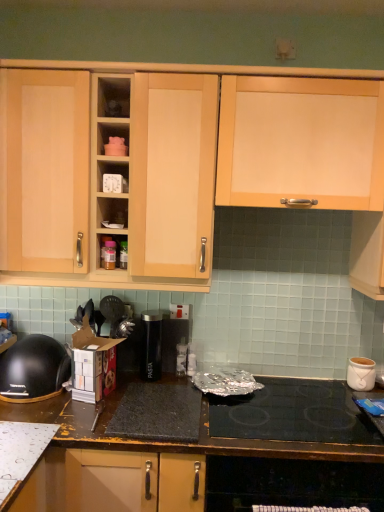
Question: Are black plastic bowl at lower left and white ceramic pot at right located far from each other?

Choices:
 (A) yes
 (B) no

Answer: (A)

Question: From the image's perspective, is black plastic bowl at lower left located above white ceramic pot at right?

Choices:
 (A) yes
 (B) no

Answer: (A)

Question: Does black plastic bowl at lower left have a greater width compared to white ceramic pot at right?

Choices:
 (A) no
 (B) yes

Answer: (B)

Question: From the image's perspective, does black plastic bowl at lower left appear lower than white ceramic pot at right?

Choices:
 (A) yes
 (B) no

Answer: (B)

Question: Is black plastic bowl at lower left looking in the opposite direction of white ceramic pot at right?

Choices:
 (A) yes
 (B) no

Answer: (B)

Question: Is the position of black plastic bowl at lower left less distant than that of white ceramic pot at right?

Choices:
 (A) yes
 (B) no

Answer: (A)

Question: Is matte plastic shelf at center, the first shelf viewed from the top, with light wood cabinet at upper right, the 1th cabinetry in the right-to-left sequence?

Choices:
 (A) no
 (B) yes

Answer: (A)

Question: Considering the relative sizes of matte plastic shelf at center, which is counted as the 2th shelf, starting from the bottom, and light wood cabinet at upper right, the 1th cabinetry in the right-to-left sequence, in the image provided, is matte plastic shelf at center, which is counted as the 2th shelf, starting from the bottom, thinner than light wood cabinet at upper right, the 1th cabinetry in the right-to-left sequence,?

Choices:
 (A) yes
 (B) no

Answer: (A)

Question: From the image's perspective, does matte plastic shelf at center, which is counted as the 2th shelf, starting from the bottom, appear lower than light wood cabinet at upper right, the 1th cabinetry in the right-to-left sequence?

Choices:
 (A) no
 (B) yes

Answer: (A)

Question: Is matte plastic shelf at center, which is counted as the 2th shelf, starting from the bottom, shorter than light wood cabinet at upper right, which ranks as the 2th cabinetry in left-to-right order?

Choices:
 (A) no
 (B) yes

Answer: (B)

Question: Is light wood cabinet at upper right, the 1th cabinetry in the right-to-left sequence, at the back of matte plastic shelf at center, which is counted as the 2th shelf, starting from the bottom?

Choices:
 (A) yes
 (B) no

Answer: (B)

Question: Is the depth of matte plastic shelf at center, the first shelf viewed from the top, greater than that of light wood cabinet at upper right, the 1th cabinetry in the right-to-left sequence?

Choices:
 (A) yes
 (B) no

Answer: (A)

Question: Is black glass cooktop at lower center at the left side of black plastic bowl at lower left?

Choices:
 (A) no
 (B) yes

Answer: (A)